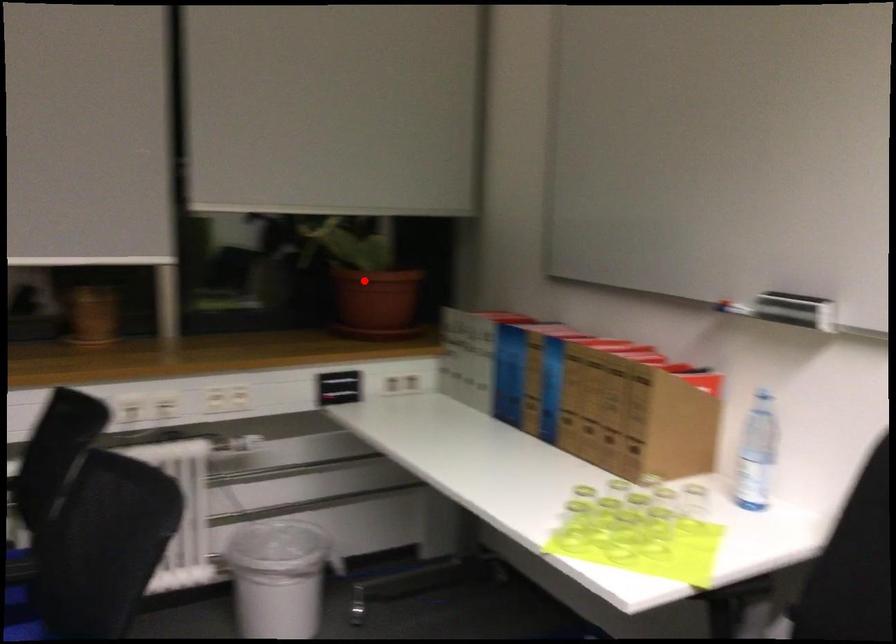
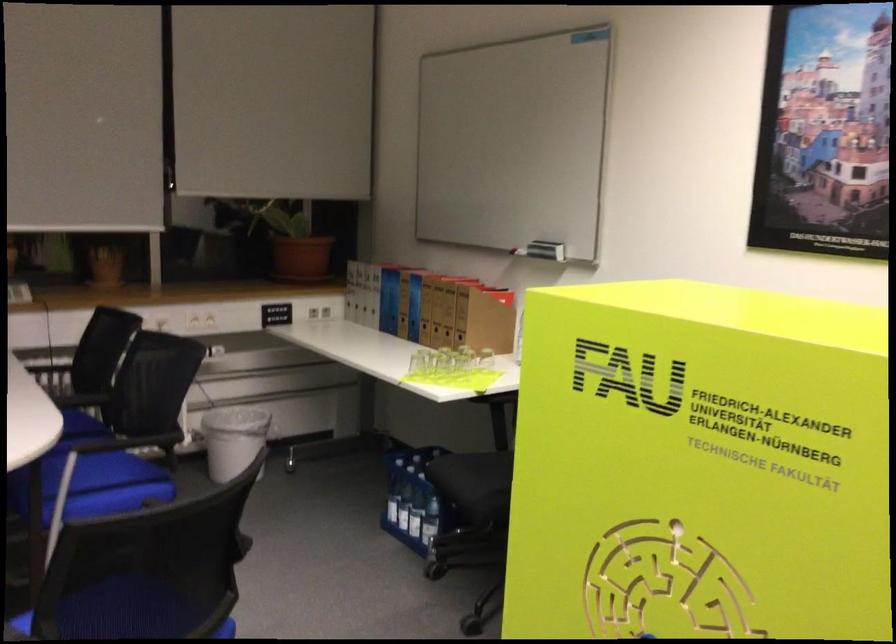
Where in the second image is the point corresponding to the highlighted location from the first image?

(294, 243)